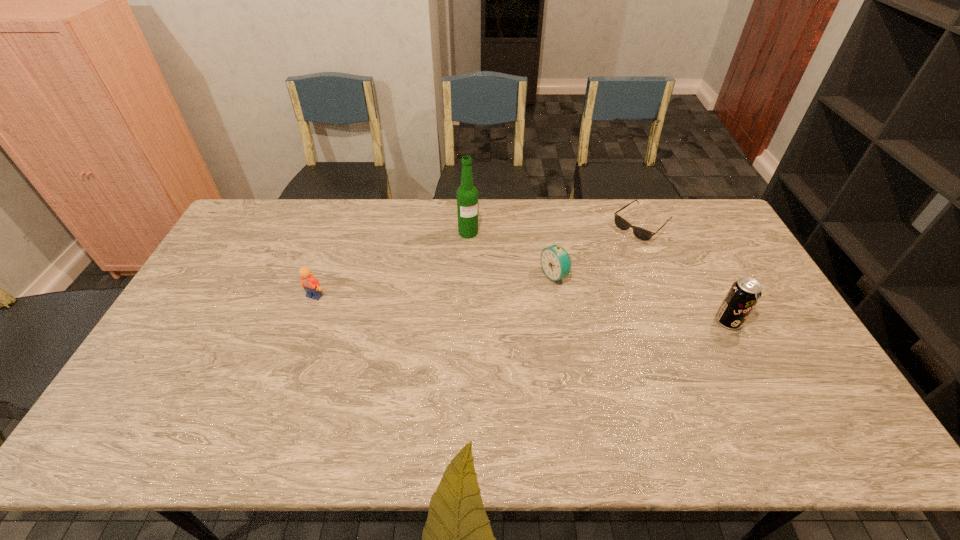
Locate an element on the screen. vacant space on the desktop that is between the fourth farthest object and the soda can and is positioned on the front-facing side of the alarm clock is located at coordinates (484, 306).

Where is `vacant space on the desktop that is between the Lego and the nearest object and is positioned on the label of the tallest object`? This screenshot has height=540, width=960. vacant space on the desktop that is between the Lego and the nearest object and is positioned on the label of the tallest object is located at coordinates (503, 307).

Locate an element on the screen. vacant space on the desktop that is between the fourth farthest object and the nearest object and is positioned on the lenses of the sunglasses is located at coordinates (538, 309).